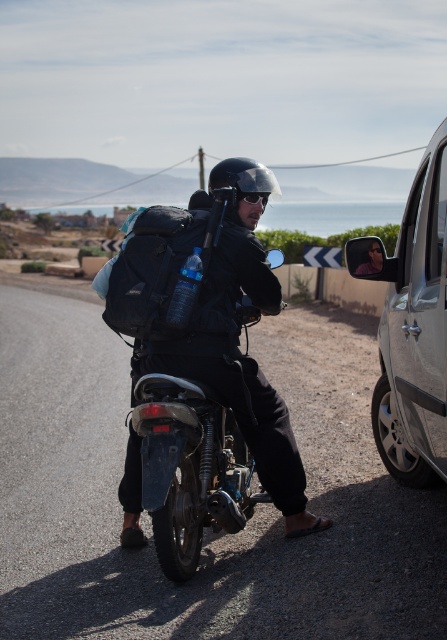
You are a pedestrian standing on the roadside and see the silver metallic car at right. You want to cross the road to reach a nearby gas station. If the road is 6 meters wide, can you safely cross without getting too close to the car?

The silver metallic car at right and viewer are 4.00 meters apart from each other. Since the road is 6 meters wide, you can cross safely by staying at least 4 meters away from the car, ensuring you don not come closer than that distance during your crossing.

Looking at this image, you are a delivery person who needs to load a package onto the motorcycle. The package must be placed on the highest available point. Which object should you place the package on between the matte black motorcycle at center and the black fabric backpack at center?

The black fabric backpack at center is higher than the matte black motorcycle at center, so you should place the package on the black fabric backpack at center.

You are a delivery driver who needs to park your motorcycle in a designated parking spot. The motorcycle is currently at point [189,467]. If the parking spot is located at point 0.6, 0.5, which direction should you move your motorcycle to reach the parking spot?

The motorcycle is currently at point [189,467]. The parking spot is at point 0.6, 0.5. To reach the parking spot, you should move the motorcycle slightly to the left and upwards since the parking spot is positioned to the left and above the current location of the motorcycle.